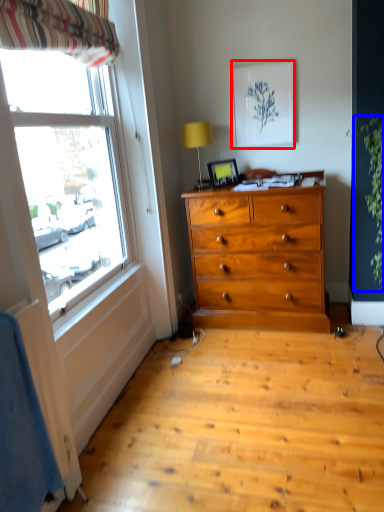
Question: Which of the following is the closest to the observer, picture frame (highlighted by a red box) or plant (highlighted by a blue box)?

Choices:
 (A) picture frame
 (B) plant

Answer: (B)